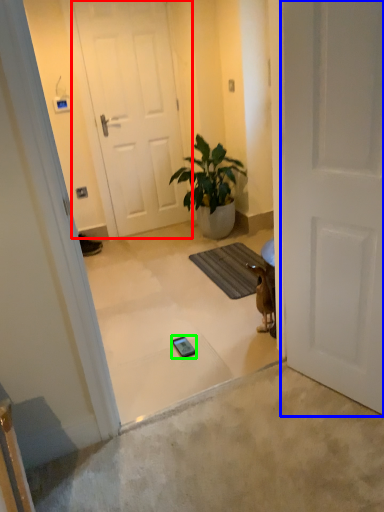
Question: Which object is the closest to the door (highlighted by a red box)? Choose among these: door (highlighted by a blue box) or mobile phone (highlighted by a green box).

Choices:
 (A) door
 (B) mobile phone

Answer: (B)